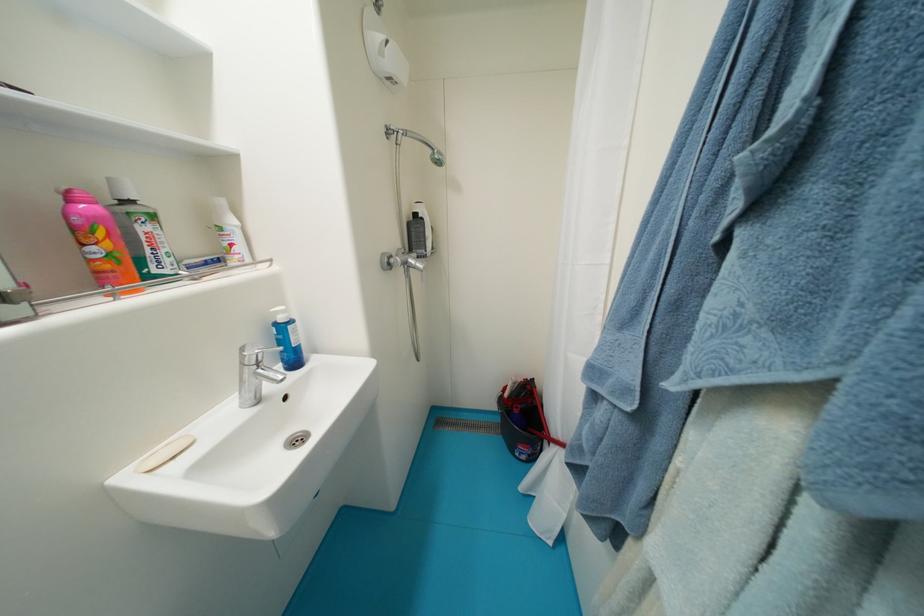
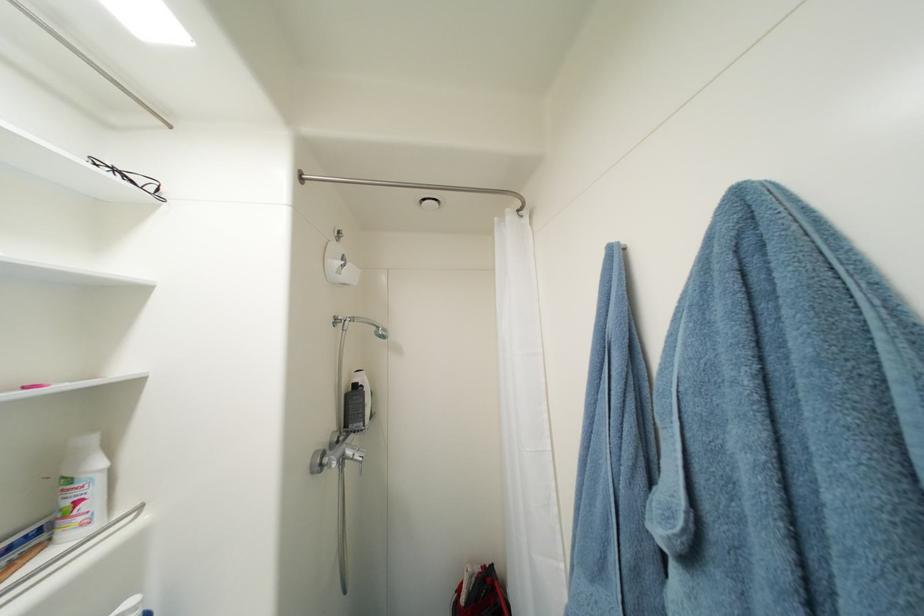
Locate, in the second image, the point that corresponds to point (421, 217) in the first image.

(361, 387)